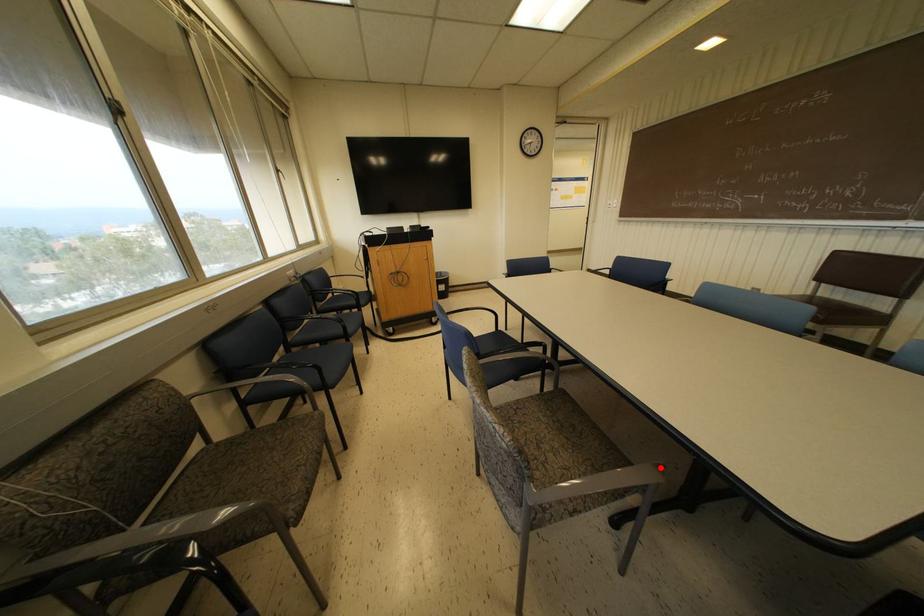
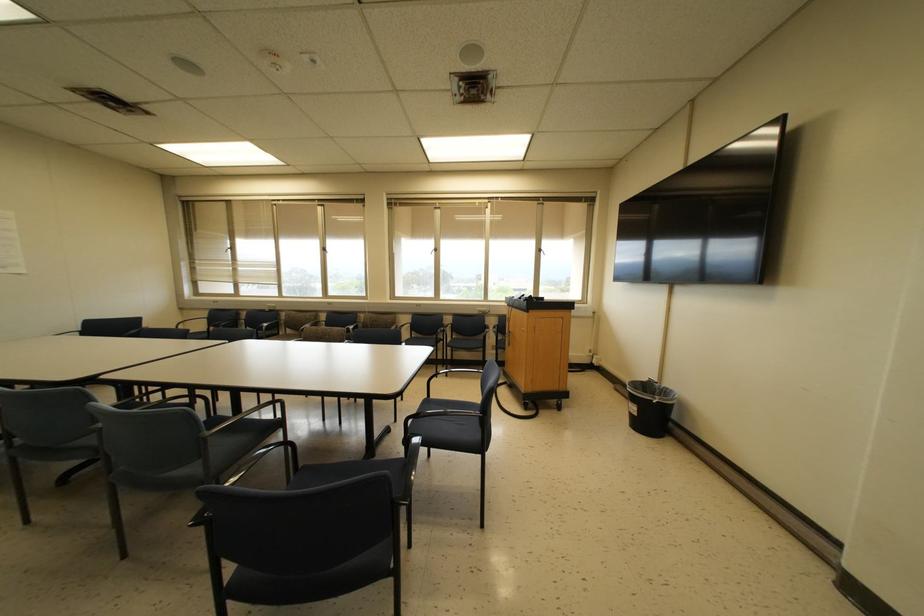
Question: I am providing you with two images of the same scene from different viewpoints. A red point is marked on the first image. Is the red point's position out of view in image 2?

Choices:
 (A) Yes
 (B) No

Answer: (A)